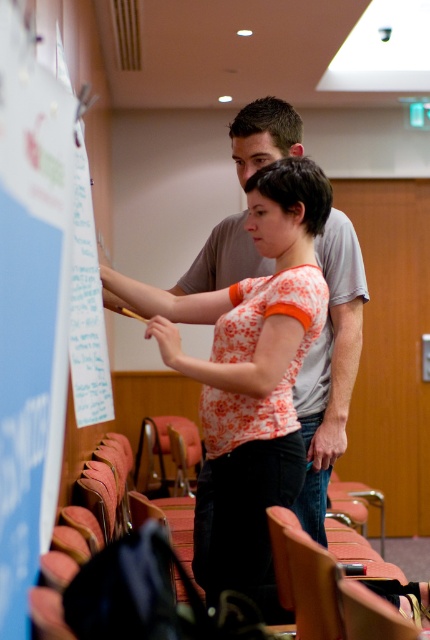
You are organizing a workshop and need to ensure that the floral cotton shirt at center and the white paper at left can both fit on a 1.2 meter wide table. Based on their sizes, will they fit together without overlapping?

The floral cotton shirt at center is larger in size than the white paper at left. Since the total width required for both items would depend on their individual dimensions, but given that the shirt is larger, it might exceed the table width. However, without exact measurements, it is uncertain if they can fit together without overlapping.

You are an interior designer observing the scene. You need to hang a picture frame that must be placed above the floral cotton shirt at center and the white paper at left. Which object should the frame be positioned above to ensure it is higher than both?

The floral cotton shirt at center has a greater height compared to white paper at left, so the picture frame should be placed above the floral cotton shirt at center to ensure it is higher than both objects.